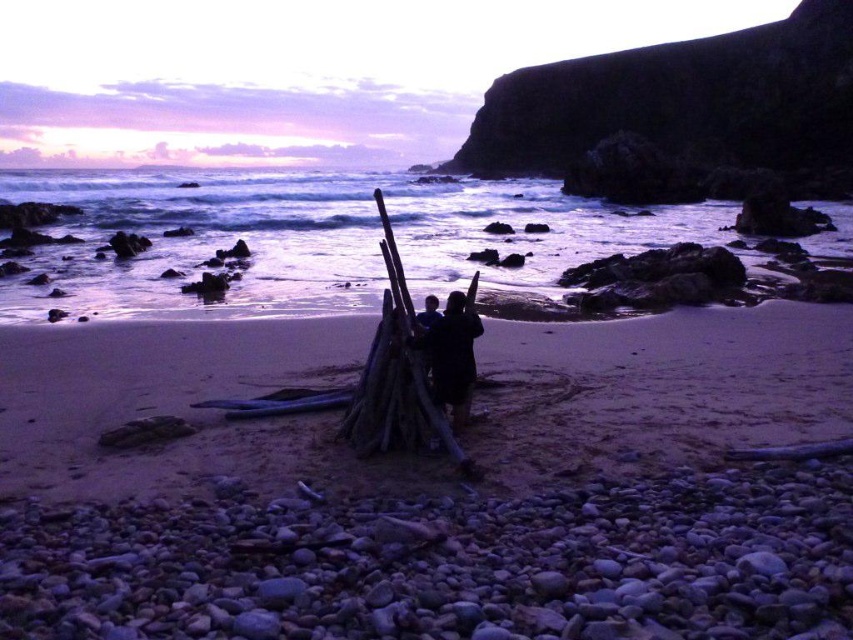
Consider the image. You are standing on the beach and want to place a small flag exactly at the center of the smooth sand at center. According to the coordinates provided, where should you place the flag?

The smooth sand at center is located at point (431, 486), so you should place the flag at those coordinates to mark its center.

You are a photographer trying to capture a wide shot of the smooth sand at center and dark clothing at center. Since you want both to be clearly visible, which object should you focus on to ensure sharpness?

The smooth sand at center is bigger than dark clothing at center, so focusing on the smooth sand at center will ensure both are in focus as it is the larger object.